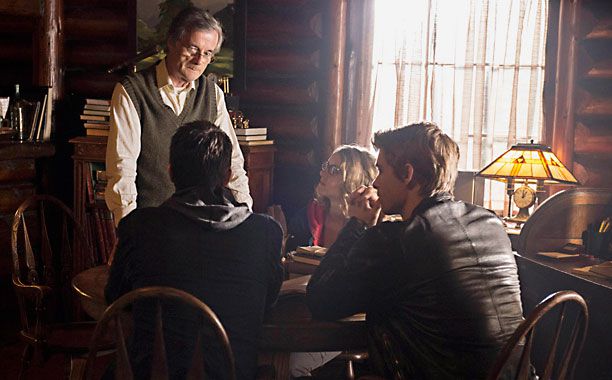
The width and height of the screenshot is (612, 380). I want to click on chairs, so click(x=47, y=238), click(x=160, y=347), click(x=559, y=324).